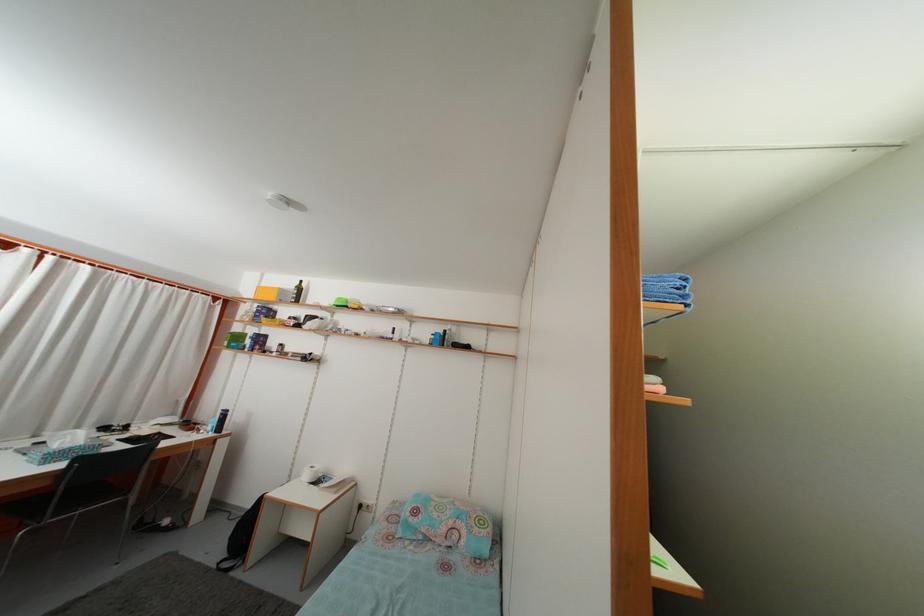
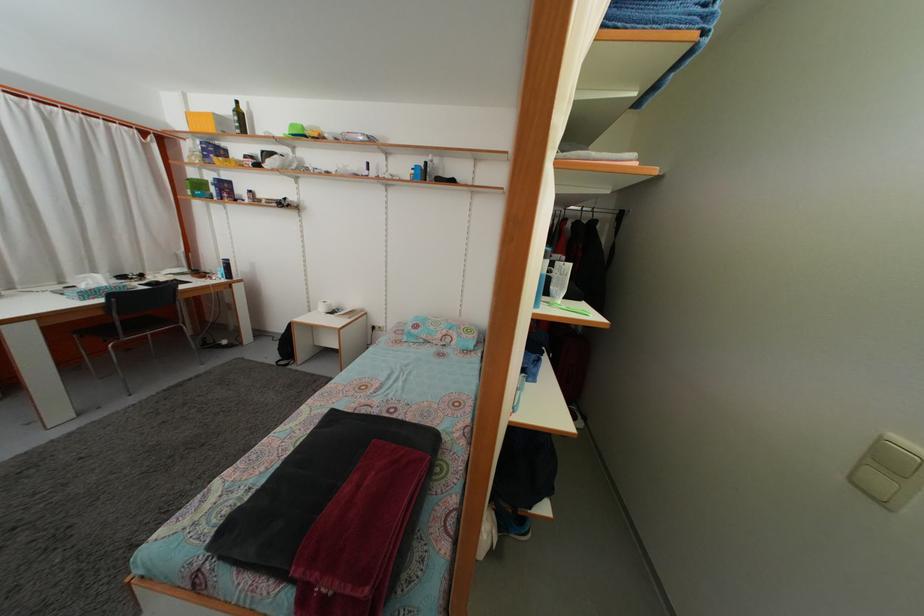
Where in the second image is the point corresponding to [344,307] from the first image?

(298, 132)